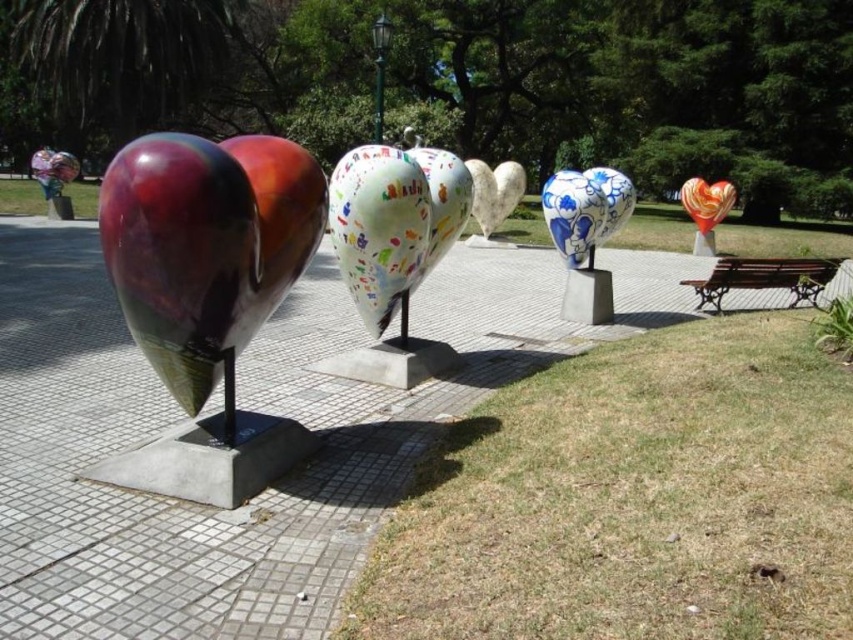
Question: Can you confirm if white glossy heart at center is positioned to the right of porcelain heart at center?

Choices:
 (A) yes
 (B) no

Answer: (B)

Question: From the image, what is the correct spatial relationship of glossy metallic heart at left in relation to multicolored glossy heart at upper right?

Choices:
 (A) right
 (B) left

Answer: (B)

Question: Which of the following is the farthest from the observer?

Choices:
 (A) (729, 182)
 (B) (805, 273)
 (C) (519, 186)
 (D) (315, 196)

Answer: (A)

Question: Does glossy metallic balloon at left have a lesser width compared to multicolored glossy heart at upper right?

Choices:
 (A) yes
 (B) no

Answer: (A)

Question: Which point is farther to the camera?

Choices:
 (A) (741, 280)
 (B) (691, 180)
 (C) (556, 221)
 (D) (466, 161)

Answer: (D)

Question: Which point is closer to the camera taking this photo?

Choices:
 (A) (285, 237)
 (B) (367, 259)

Answer: (A)